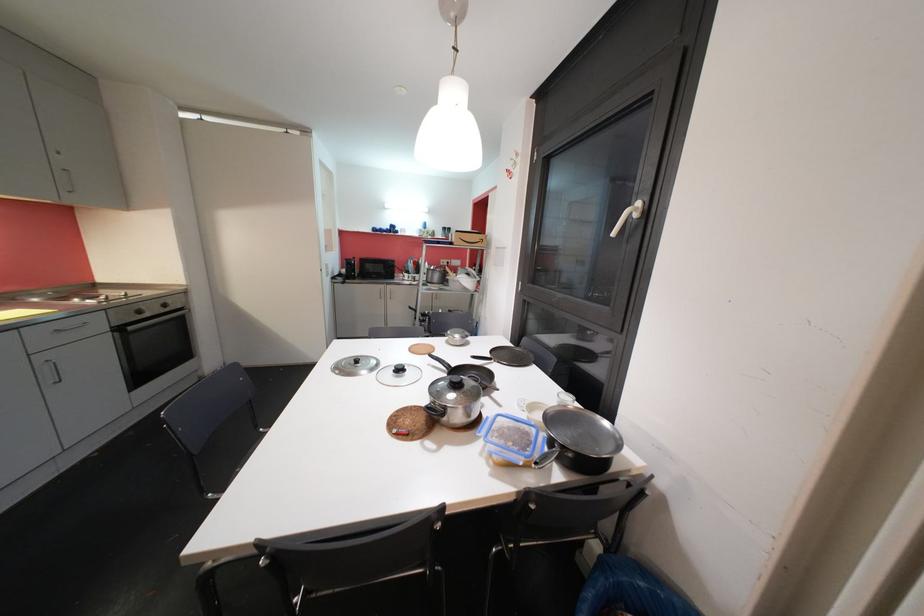
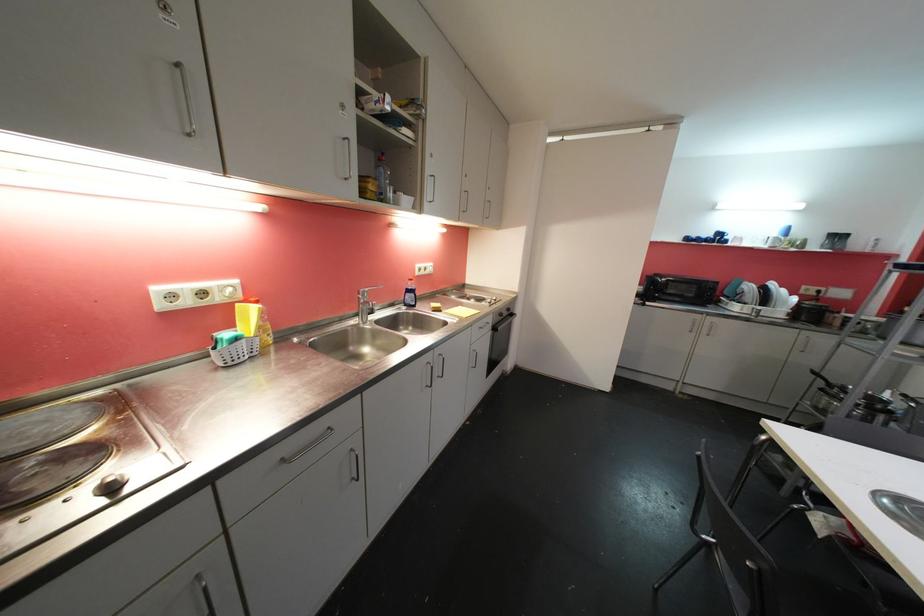
Where in the second image is the point corresponding to pixel 144 314 from the first image?

(505, 317)